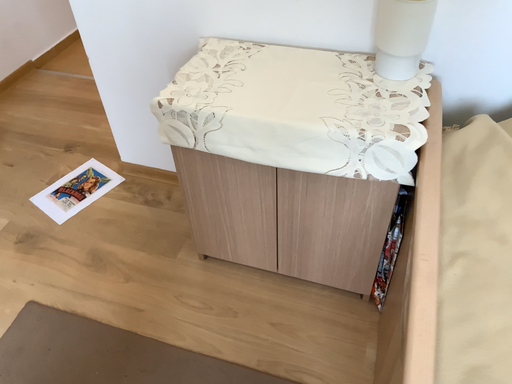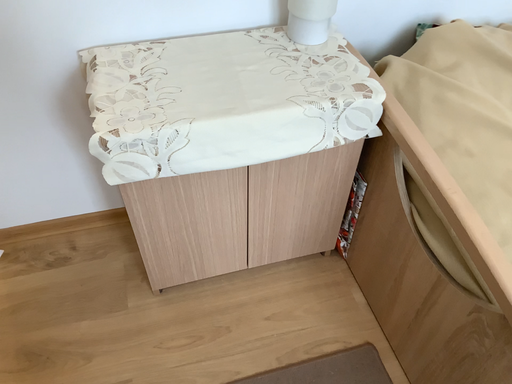
Question: How did the camera likely rotate when shooting the video?

Choices:
 (A) rotated left
 (B) rotated right

Answer: (B)